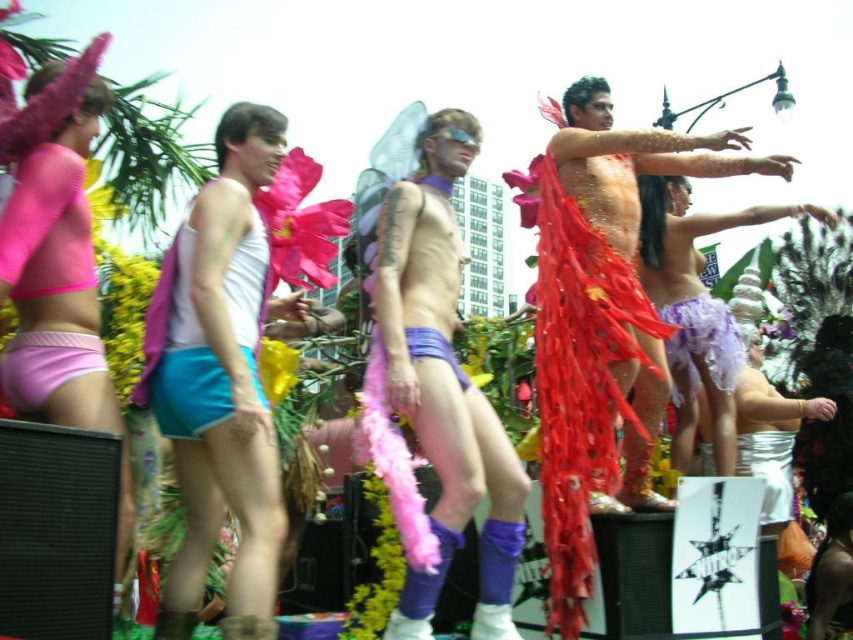
You are a photographer at the festival and want to capture both the purple matte shorts at center and the matte purple tulle skirt at right in a single frame. Which object should you focus on first to ensure both are in the shot?

The purple matte shorts at center is in front of the matte purple tulle skirt at right, so you should focus on the purple matte shorts at center first to ensure both are in the shot.

You are a photographer at the parade and want to capture both the purple matte shorts at center and the shiny metallic man at center in a single frame. Based on their positions, which object should you focus on first to ensure both are in the shot?

The purple matte shorts at center is positioned on the left side of shiny metallic man at center, so you should focus on the shiny metallic man at center first to ensure both are in the shot.